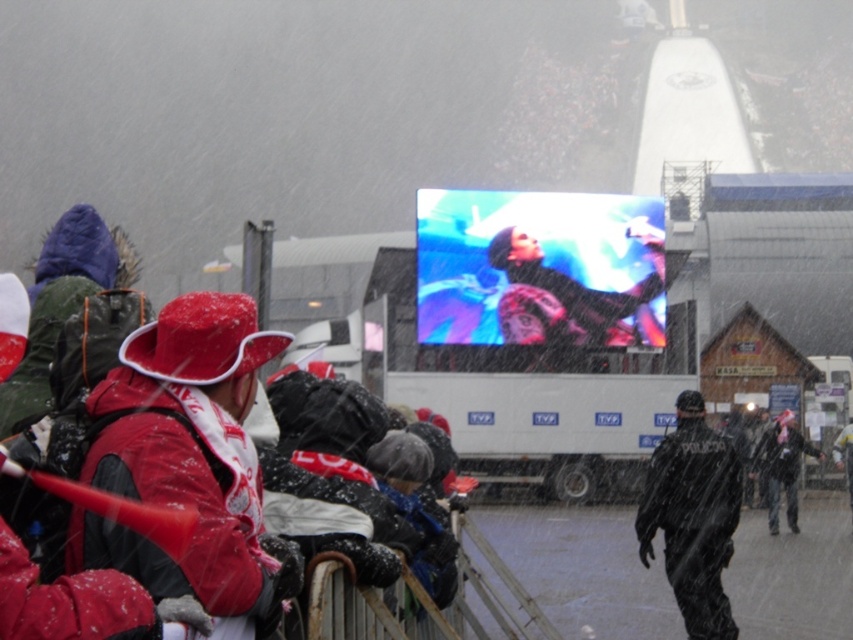
Question: Is red matte hat at left thinner than dark gray fabric jacket at center?

Choices:
 (A) yes
 (B) no

Answer: (B)

Question: Which object is farther from the camera taking this photo?

Choices:
 (A) black uniformed officer at center
 (B) dark gray fabric jacket at center
 (C) red matte hat at left

Answer: (B)

Question: Which point is farther to the camera?

Choices:
 (A) dark gray fabric jacket at center
 (B) black uniformed officer at center

Answer: (A)

Question: Which object is positioned closest to the dark gray fabric jacket at center?

Choices:
 (A) black uniformed officer at center
 (B) red matte hat at left

Answer: (A)

Question: Is red matte hat at left to the right of black uniformed officer at center from the viewer's perspective?

Choices:
 (A) no
 (B) yes

Answer: (A)

Question: Is black uniformed officer at center further to camera compared to dark gray fabric jacket at center?

Choices:
 (A) yes
 (B) no

Answer: (B)